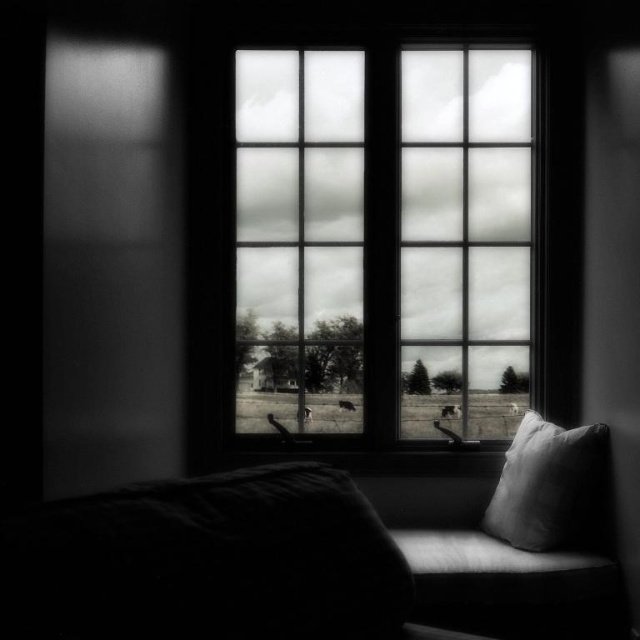
You are sitting on the cushioned bench with a pillow in front of the clear glass window at center and the dark fabric at lower left. Which object is closer to your left side?

The dark fabric at lower left is closer to your left side since it is positioned on the left side of the clear glass window at center.

You are standing in a room with a large window. You notice a point marked at coordinates (385, 237). What object is located at that point?

The point at coordinates (385, 237) marks the clear glass window at center.

You are standing in a room with a large window. There is a point at coordinates point (x=385, y=237). Where is this point located?

The point (x=385, y=237) is on the clear glass window at center.